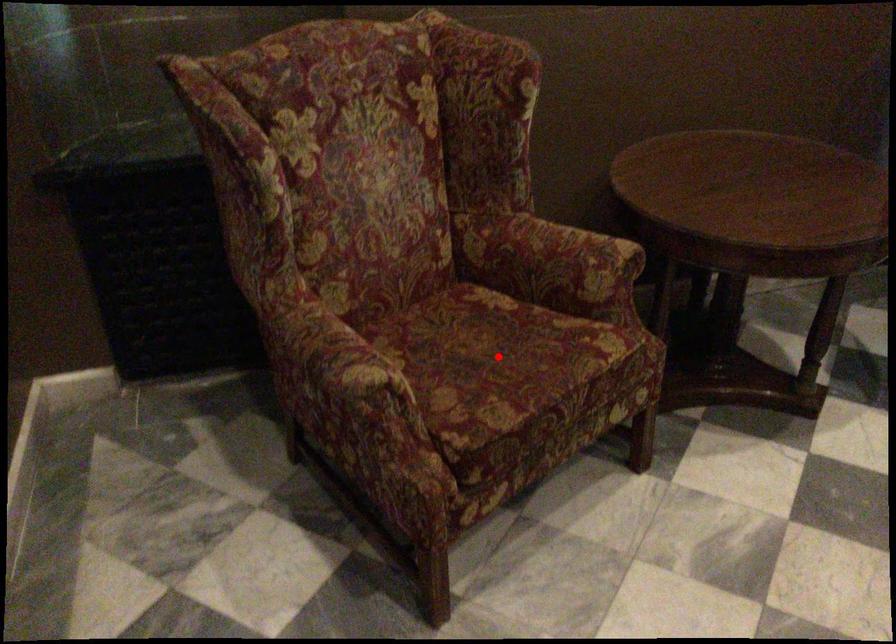
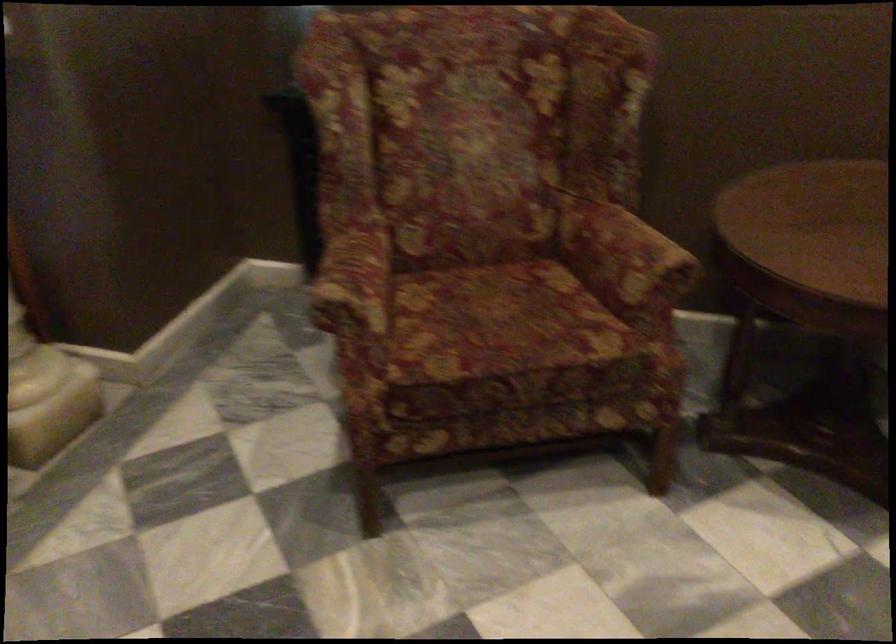
The point at the highlighted location is marked in the first image. Where is the corresponding point in the second image?

(501, 323)